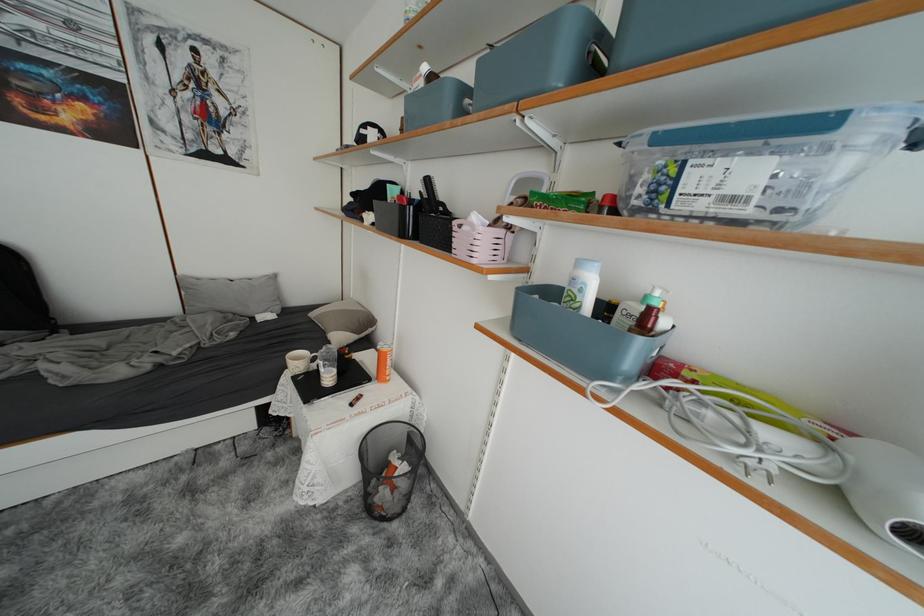
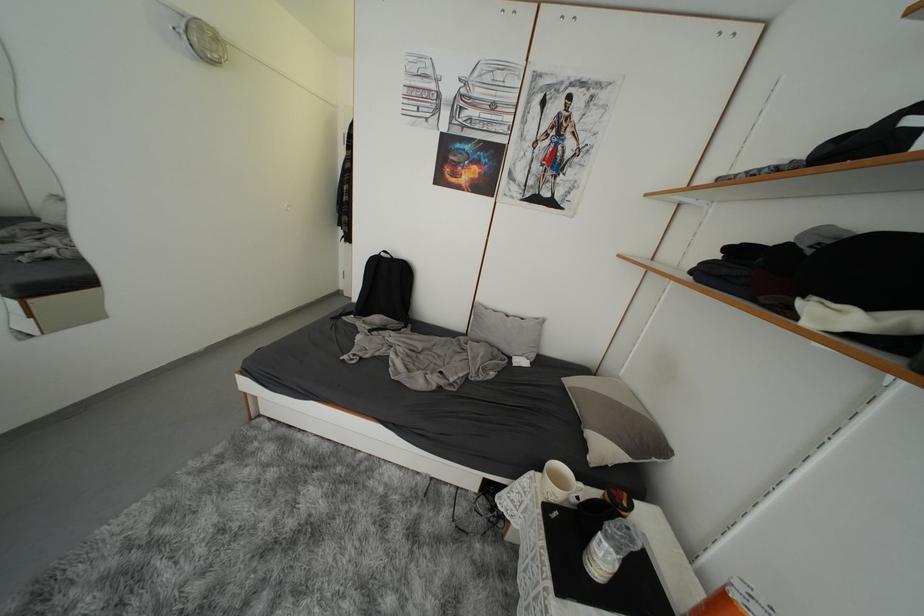
Question: The camera is either moving clockwise (left) or counter-clockwise (right) around the object. The first image is from the beginning of the video and the second image is from the end. Is the camera moving left or right when shooting the video?

Choices:
 (A) Left
 (B) Right

Answer: (B)